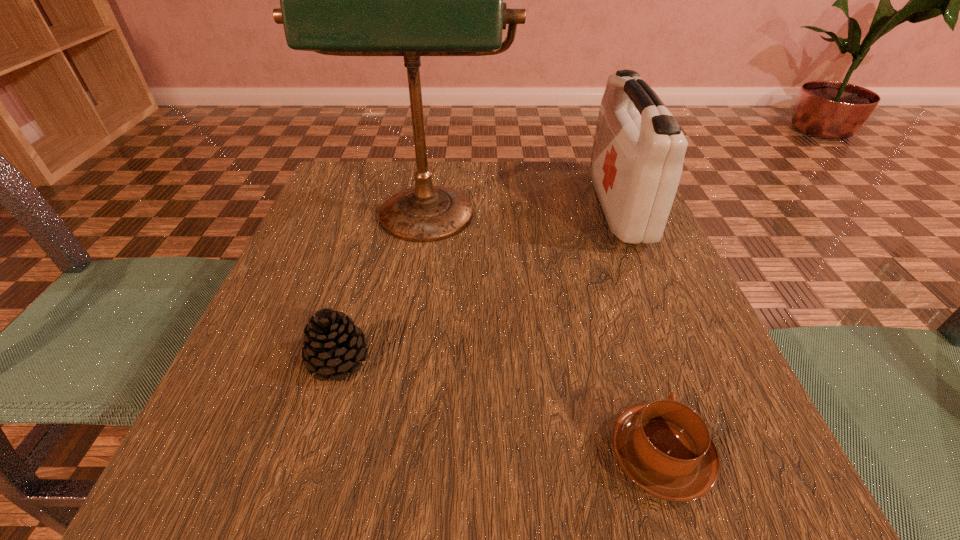
Where is `vacant space that's between the second nearest object and the first-aid kit`? vacant space that's between the second nearest object and the first-aid kit is located at coordinates (479, 284).

This screenshot has width=960, height=540. In order to click on empty space between the second tallest object and the tallest object in this screenshot , I will do `click(522, 215)`.

Find the location of a particular element. free space between the pinecone and the shortest object is located at coordinates (499, 408).

Where is `free space between the third shortest object and the shortest object`? The height and width of the screenshot is (540, 960). free space between the third shortest object and the shortest object is located at coordinates (639, 331).

Find the location of a particular element. unoccupied area between the third farthest object and the second tallest object is located at coordinates (479, 284).

This screenshot has width=960, height=540. I want to click on vacant area between the nearest object and the tallest object, so click(542, 339).

Locate an element on the screen. unoccupied area between the second shortest object and the third shortest object is located at coordinates (479, 284).

Where is `free spot between the table lamp and the pinecone`? free spot between the table lamp and the pinecone is located at coordinates (382, 292).

Where is `free spot between the third tallest object and the second tallest object`? free spot between the third tallest object and the second tallest object is located at coordinates (479, 284).

You are a GUI agent. You are given a task and a screenshot of the screen. Output one action in this format:
    pyautogui.click(x=<x>, y=<y>)
    Task: Click on the vacant space that's between the first-aid kit and the second nearest object
    
    Given the screenshot: What is the action you would take?
    pyautogui.click(x=479, y=284)